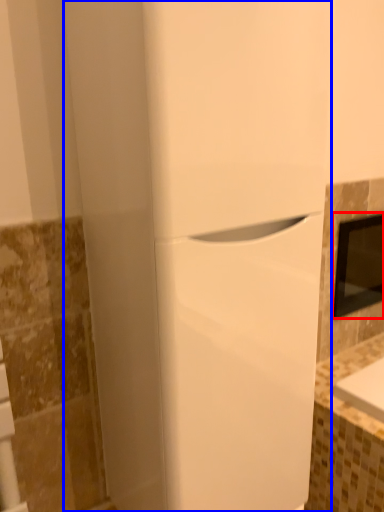
Question: Which object appears farthest to the camera in this image, medicine cabinet (highlighted by a red box) or home appliance (highlighted by a blue box)?

Choices:
 (A) medicine cabinet
 (B) home appliance

Answer: (A)